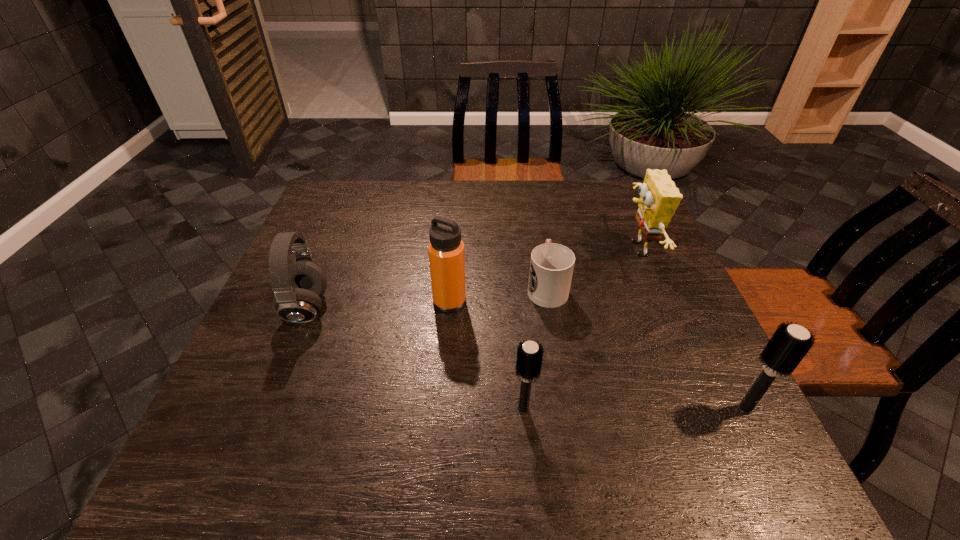
Given the evenly spaced hairbrushs in the image, where should an extra hairbrush be added on the left to preserve the spacing? Please point to a vacant space. Please provide its 2D coordinates. Your answer should be formatted as a tuple, i.e. [(x, y)], where the tuple contains the x and y coordinates of a point satisfying the conditions above.

[(302, 410)]